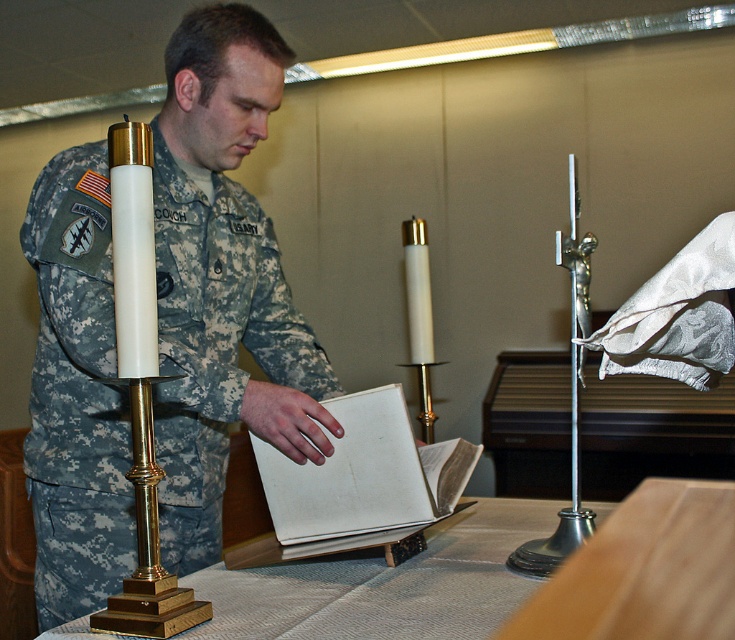
Question: Which object appears closest to the camera in this image?

Choices:
 (A) white polished brass candle holder at left
 (B) gold polished table at center
 (C) camouflage fabric uniform at center
 (D) off-white paper book at center

Answer: (A)

Question: Can you confirm if camouflage fabric uniform at center is smaller than white polished brass candle holder at left?

Choices:
 (A) yes
 (B) no

Answer: (B)

Question: Can you confirm if camouflage fabric uniform at center is positioned to the left of gold polished table at center?

Choices:
 (A) no
 (B) yes

Answer: (B)

Question: Which object appears farthest from the camera in this image?

Choices:
 (A) off-white paper book at center
 (B) gold polished table at center
 (C) camouflage fabric uniform at center
 (D) white polished brass candle holder at left

Answer: (A)

Question: Can you confirm if camouflage fabric uniform at center is positioned to the left of gold polished table at center?

Choices:
 (A) no
 (B) yes

Answer: (B)

Question: Which object is positioned closest to the white polished brass candle holder at left?

Choices:
 (A) camouflage fabric uniform at center
 (B) gold polished table at center
 (C) off-white paper book at center

Answer: (A)